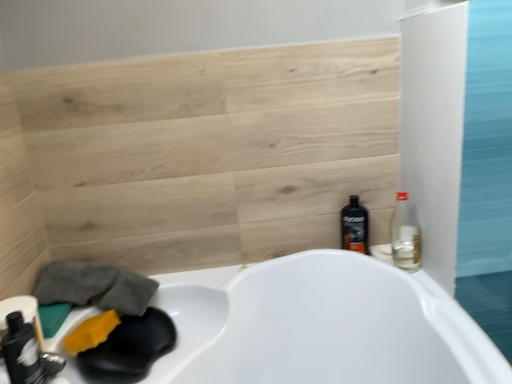
Question: Is yellow sponge at lower left facing away from matte black bottle at lower left, which is the 3th bottle from right to left?

Choices:
 (A) yes
 (B) no

Answer: (B)

Question: Is yellow sponge at lower left facing towards matte black bottle at lower left, which is counted as the first bottle, starting from the front?

Choices:
 (A) no
 (B) yes

Answer: (A)

Question: From the image's perspective, is yellow sponge at lower left above matte black bottle at lower left, which is the 3th bottle from right to left?

Choices:
 (A) no
 (B) yes

Answer: (A)

Question: Does yellow sponge at lower left have a smaller size compared to matte black bottle at lower left, which is the 3th bottle from right to left?

Choices:
 (A) yes
 (B) no

Answer: (A)

Question: Does yellow sponge at lower left touch matte black bottle at lower left, marked as the first bottle in a left-to-right arrangement?

Choices:
 (A) no
 (B) yes

Answer: (A)

Question: Choose the correct answer: Is black plastic bottle at right, acting as the 1th bottle starting from the back, inside yellow sponge at lower left or outside it?

Choices:
 (A) inside
 (B) outside

Answer: (B)

Question: Does point (362, 210) appear closer or farther from the camera than point (92, 326)?

Choices:
 (A) closer
 (B) farther

Answer: (B)

Question: Is black plastic bottle at right, marked as the third bottle in a front-to-back arrangement, taller or shorter than yellow sponge at lower left?

Choices:
 (A) tall
 (B) short

Answer: (A)

Question: Is black plastic bottle at right, marked as the third bottle in a front-to-back arrangement, bigger or smaller than yellow sponge at lower left?

Choices:
 (A) small
 (B) big

Answer: (B)

Question: From the image's perspective, is clear glass bottle at right, which is the second bottle in front-to-back order, located above or below black plastic bottle at right, which ranks as the 2th bottle in right-to-left order?

Choices:
 (A) below
 (B) above

Answer: (B)

Question: Is clear glass bottle at right, which is the second bottle in front-to-back order, situated inside black plastic bottle at right, marked as the third bottle in a front-to-back arrangement, or outside?

Choices:
 (A) inside
 (B) outside

Answer: (B)

Question: From a real-world perspective, is clear glass bottle at right, which is the first bottle from right to left, positioned above or below black plastic bottle at right, placed as the second bottle when sorted from left to right?

Choices:
 (A) above
 (B) below

Answer: (A)

Question: Considering the positions of clear glass bottle at right, marked as the third bottle in a left-to-right arrangement, and black plastic bottle at right, marked as the third bottle in a front-to-back arrangement, in the image, is clear glass bottle at right, marked as the third bottle in a left-to-right arrangement, taller or shorter than black plastic bottle at right, marked as the third bottle in a front-to-back arrangement,?

Choices:
 (A) tall
 (B) short

Answer: (B)

Question: From the image's perspective, is black plastic bottle at right, which ranks as the 2th bottle in right-to-left order, above or below matte black bottle at lower left, which is counted as the first bottle, starting from the front?

Choices:
 (A) above
 (B) below

Answer: (A)

Question: Considering the positions of black plastic bottle at right, acting as the 1th bottle starting from the back, and matte black bottle at lower left, which is the 3th bottle from right to left, in the image, is black plastic bottle at right, acting as the 1th bottle starting from the back, taller or shorter than matte black bottle at lower left, which is the 3th bottle from right to left,?

Choices:
 (A) short
 (B) tall

Answer: (B)